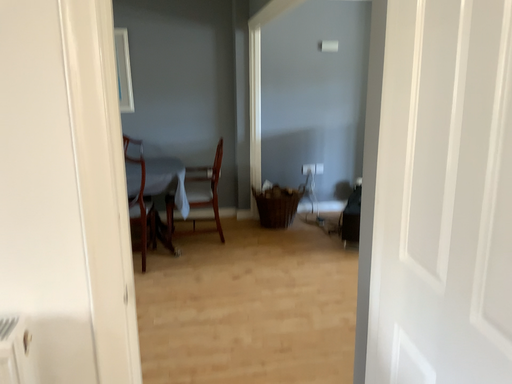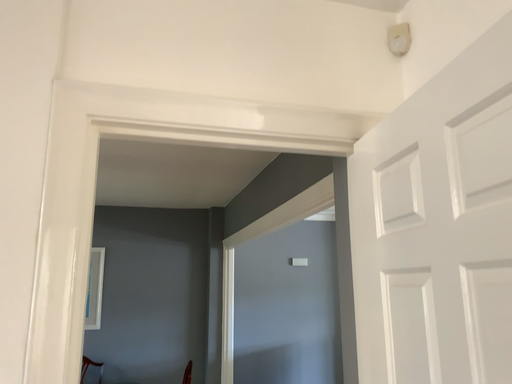
Question: Which way did the camera rotate in the video?

Choices:
 (A) rotated upward
 (B) rotated downward

Answer: (A)